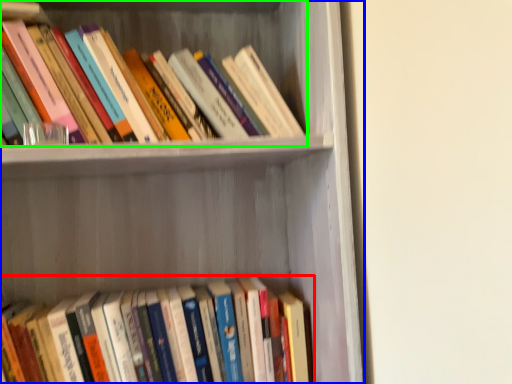
Question: Which object is positioned closest to book (highlighted by a red box)? Select from shelf (highlighted by a blue box) and book (highlighted by a green box).

Choices:
 (A) shelf
 (B) book

Answer: (A)